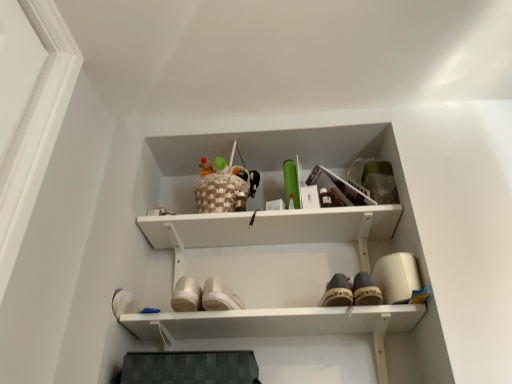
Question: Considering the relative positions of woven basket at upper center and white canvas shoe at center in the image provided, is woven basket at upper center to the left or to the right of white canvas shoe at center?

Choices:
 (A) right
 (B) left

Answer: (B)

Question: Does point (228, 165) appear closer or farther from the camera than point (338, 283)?

Choices:
 (A) farther
 (B) closer

Answer: (A)

Question: In the image, is woven basket at upper center positioned in front of or behind white canvas shoe at center?

Choices:
 (A) front
 (B) behind

Answer: (B)

Question: Would you say white canvas shoe at center is to the left or to the right of woven basket at upper center in the picture?

Choices:
 (A) left
 (B) right

Answer: (B)

Question: In terms of width, does white canvas shoe at center look wider or thinner when compared to woven basket at upper center?

Choices:
 (A) wide
 (B) thin

Answer: (A)

Question: From a real-world perspective, is white canvas shoe at center physically located above or below woven basket at upper center?

Choices:
 (A) above
 (B) below

Answer: (B)

Question: In terms of height, does white canvas shoe at center look taller or shorter compared to woven basket at upper center?

Choices:
 (A) tall
 (B) short

Answer: (B)